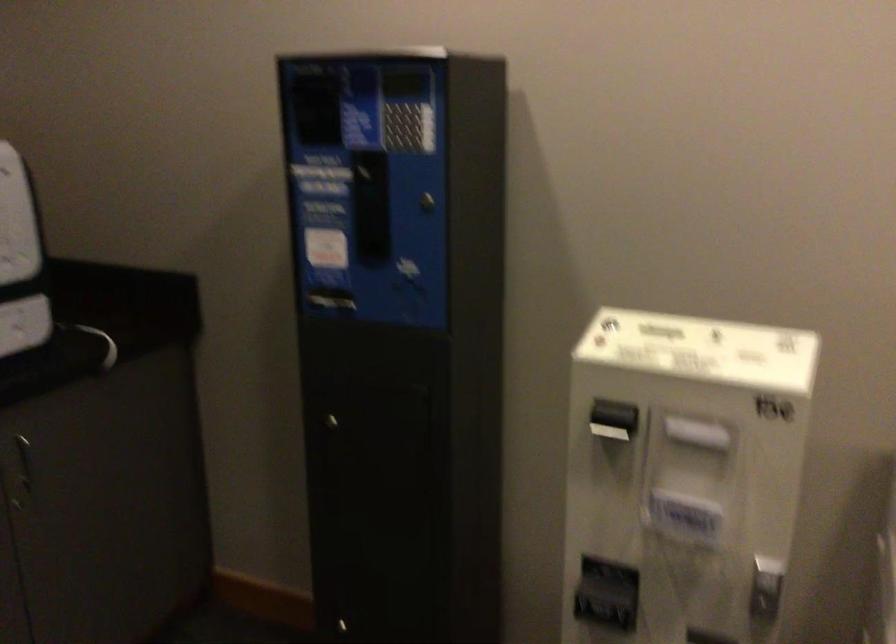
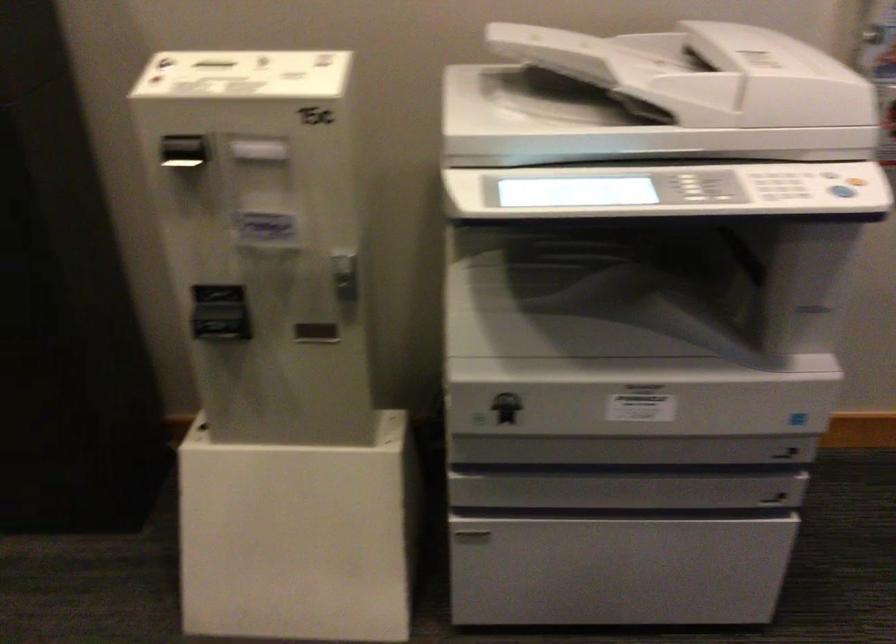
Locate, in the second image, the point that corresponds to pixel 608 424 in the first image.

(185, 156)